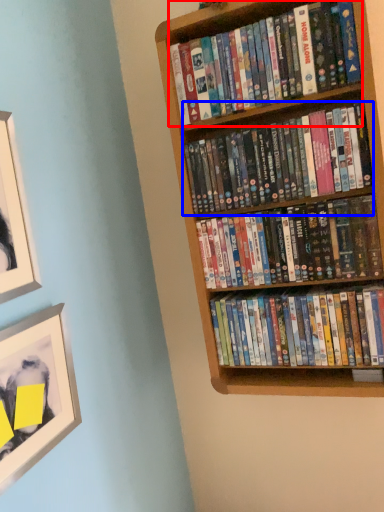
Question: Among these objects, which one is nearest to the camera, book (highlighted by a red box) or book (highlighted by a blue box)?

Choices:
 (A) book
 (B) book

Answer: (A)